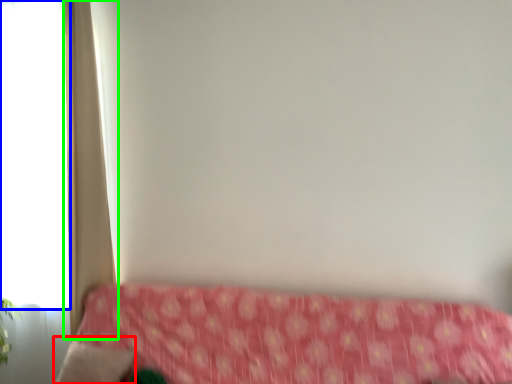
Question: Estimate the real-world distances between objects in this image. Which object is closer to pillow (highlighted by a red box), window (highlighted by a blue box) or curtain (highlighted by a green box)?

Choices:
 (A) window
 (B) curtain

Answer: (B)